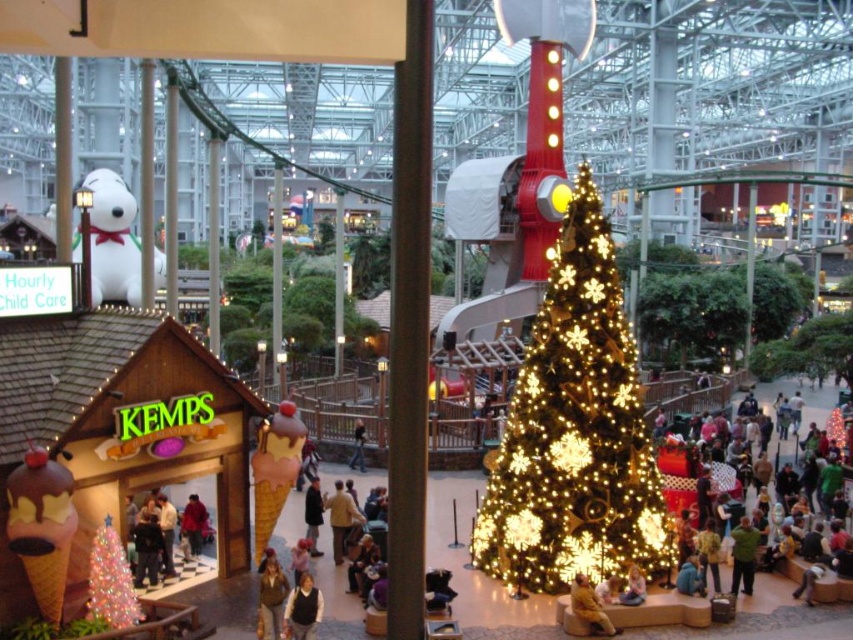
Question: Estimate the real-world distances between objects in this image. Which object is closer to the white plush snowman at left?

Choices:
 (A) brown fabric jacket at lower center
 (B) yellow plush bear at lower right
 (C) illuminated gold christmas tree at center
 (D) shiny silver christmas tree at lower left

Answer: (C)

Question: Is white plush snowman at left positioned at the back of yellow plush bear at lower right?

Choices:
 (A) yes
 (B) no

Answer: (A)

Question: Does illuminated gold christmas tree at center appear under brown fabric jacket at lower center?

Choices:
 (A) no
 (B) yes

Answer: (A)

Question: Among these points, which one is nearest to the camera?

Choices:
 (A) (289, 593)
 (B) (492, 496)

Answer: (A)

Question: Where is illuminated gold christmas tree at center located in relation to white plush snowman at left in the image?

Choices:
 (A) right
 (B) left

Answer: (A)

Question: Which object is positioned closest to the illuminated gold christmas tree at center?

Choices:
 (A) brown fabric jacket at lower center
 (B) yellow plush bear at lower right
 (C) white plush snowman at left

Answer: (B)